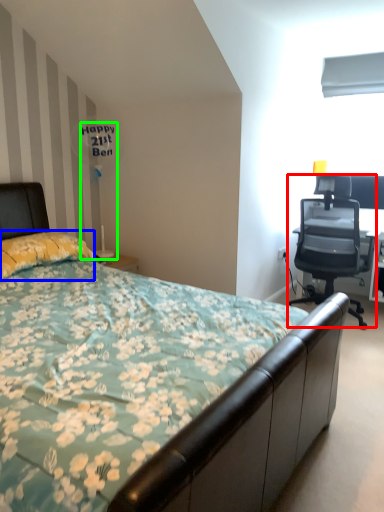
Question: Which is nearer to the chair (highlighted by a red box)? pillow (highlighted by a blue box) or table lamp (highlighted by a green box).

Choices:
 (A) pillow
 (B) table lamp

Answer: (B)